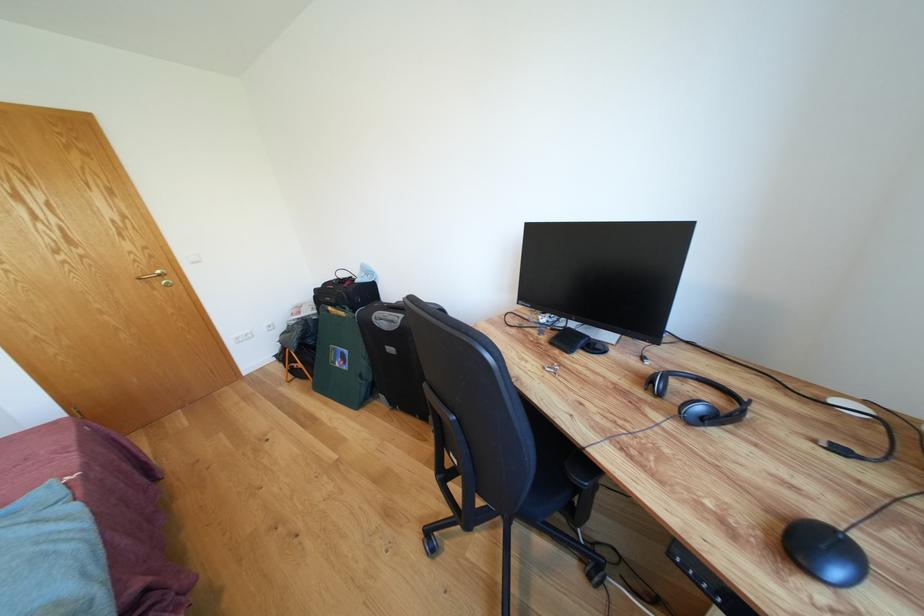
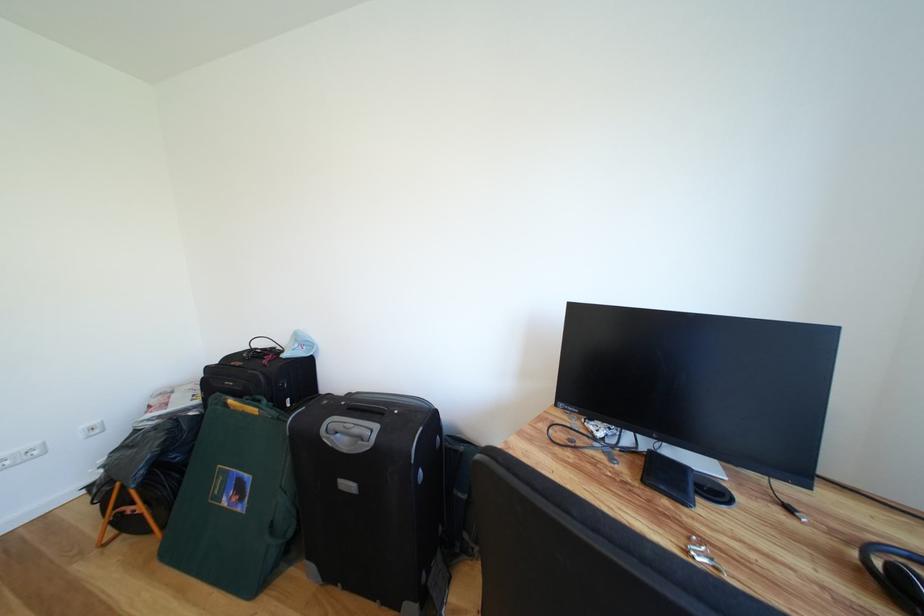
Which direction would the cameraman need to move to produce the second image?

The movement direction of the cameraman is left, forward.